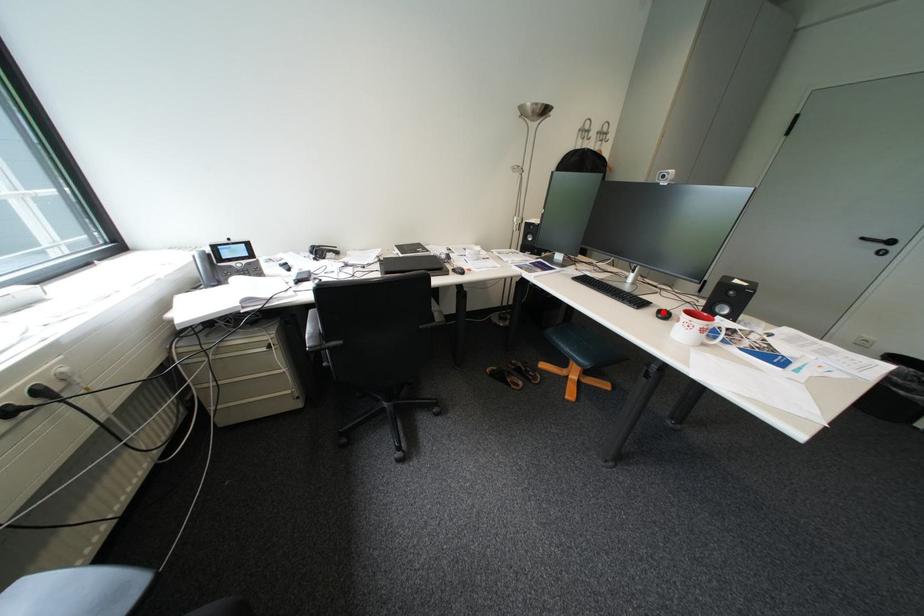
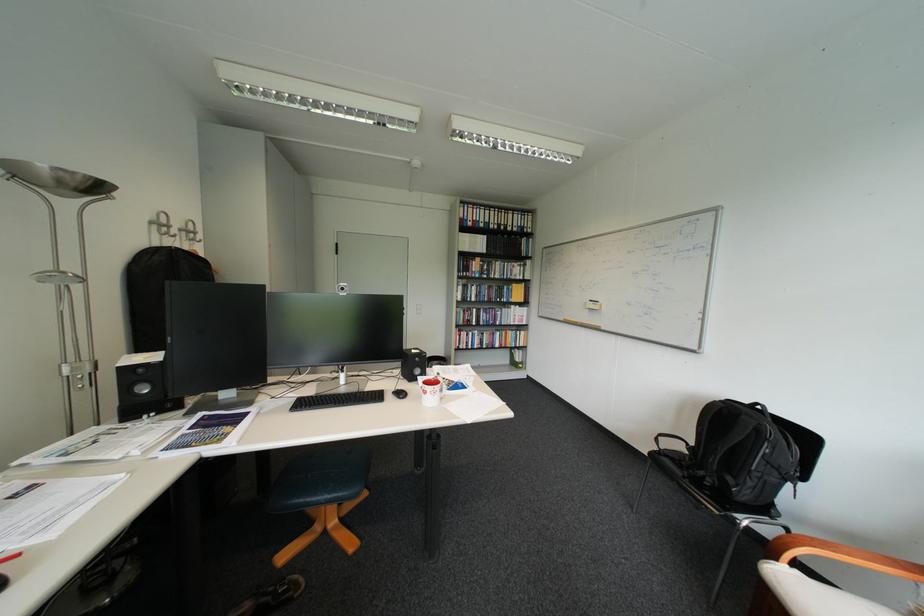
Where in the second image is the point corresponding to the highlighted location from the first image?

(400, 398)